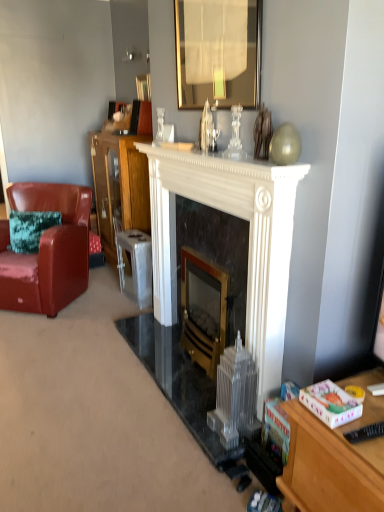
Identify the location of vacant space situated on the left part of metallic silver stool at center. (107, 298).